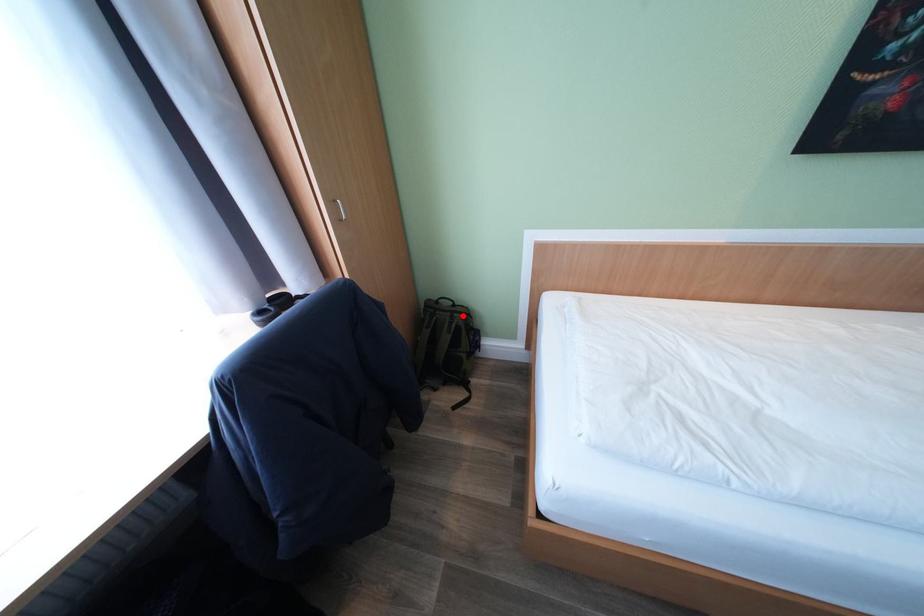
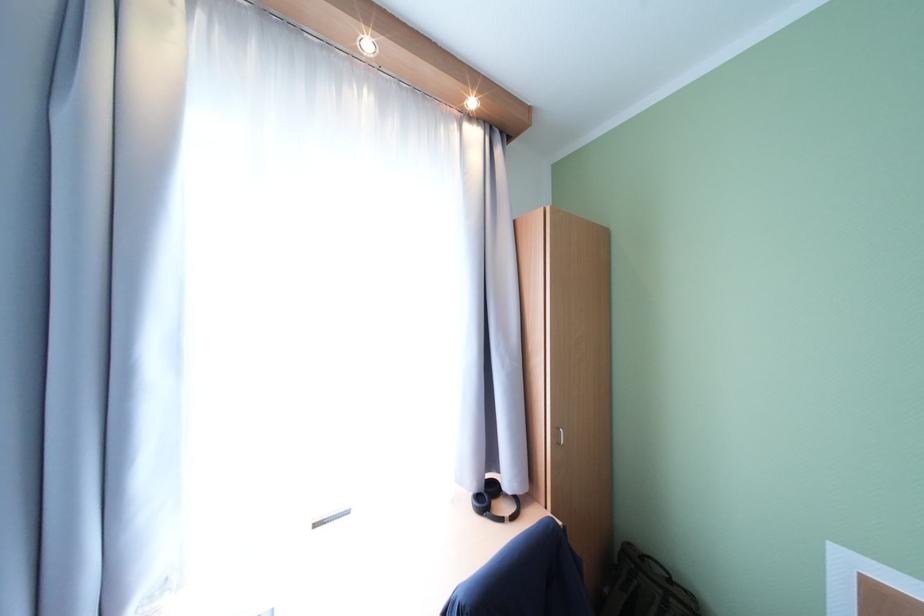
Where in the second image is the point corresponding to the highlighted location from the first image?

(679, 602)